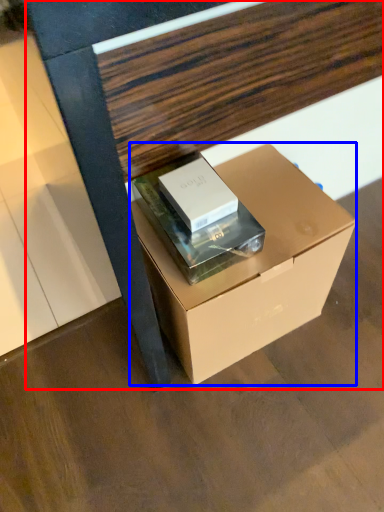
Question: Which object is closer to the camera taking this photo, furniture (highlighted by a red box) or box (highlighted by a blue box)?

Choices:
 (A) furniture
 (B) box

Answer: (A)